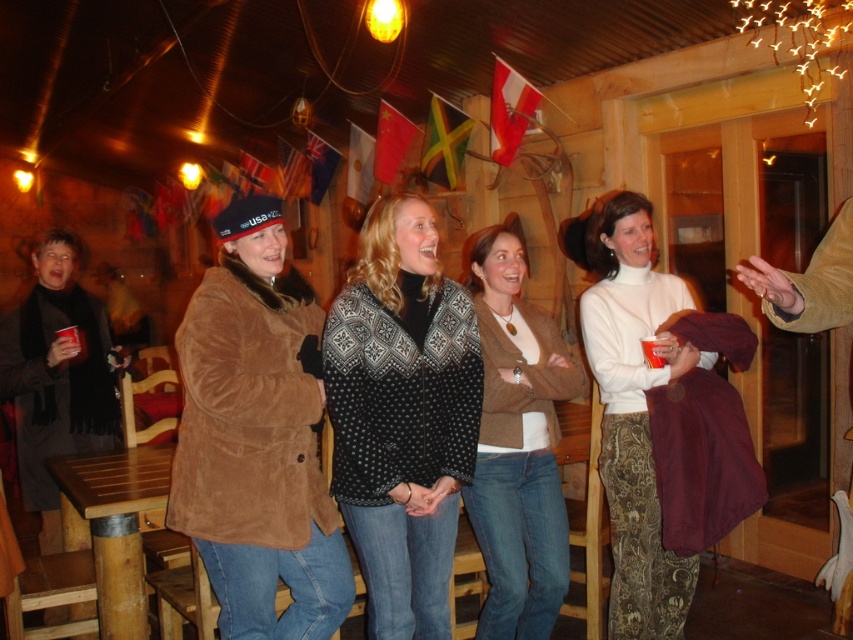
Can you confirm if black knitwear at center is positioned to the right of knit sweater at center?

In fact, black knitwear at center is to the left of knit sweater at center.

Does point (357, 506) lie behind point (486, 560)?

That is False.

Where is `black knitwear at center`? This screenshot has height=640, width=853. black knitwear at center is located at coordinates (401, 416).

Where is `knit sweater at center`? knit sweater at center is located at coordinates (517, 445).

Measure the distance between knit sweater at center and white turtleneck sweater at center.

A distance of 11.22 inches exists between knit sweater at center and white turtleneck sweater at center.

Does point (473, 268) lie in front of point (590, 365)?

No, (473, 268) is further to viewer.

Locate an element on the screen. Image resolution: width=853 pixels, height=640 pixels. knit sweater at center is located at coordinates (517, 445).

Looking at this image, between black knitwear at center and white turtleneck sweater at center, which one has less height?

With less height is black knitwear at center.

Does black knitwear at center have a lesser width compared to white turtleneck sweater at center?

No.

The image size is (853, 640). Find the location of `black knitwear at center`. black knitwear at center is located at coordinates (401, 416).